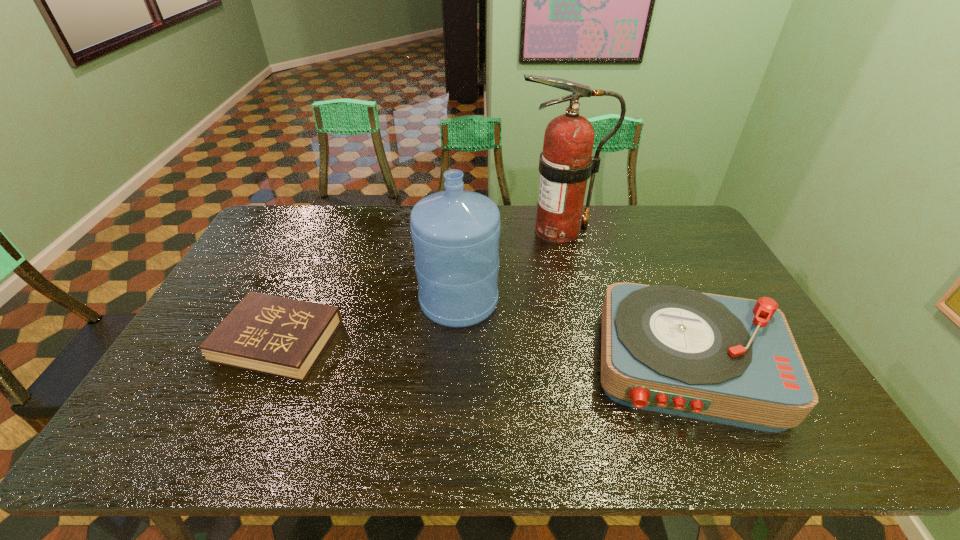
In the image, there is a desktop. Identify the location of vacant region at the far edge. This screenshot has height=540, width=960. (509, 213).

This screenshot has width=960, height=540. What are the coordinates of `vacant space at the near edge of the desktop` in the screenshot? It's located at (293, 433).

The height and width of the screenshot is (540, 960). I want to click on blank space at the left edge of the desktop, so click(237, 271).

At what (x,y) coordinates should I click in order to perform the action: click on vacant space at the right edge. Please return your answer as a coordinate pair (x, y). This screenshot has height=540, width=960. Looking at the image, I should click on (689, 246).

In the image, there is a desktop. What are the coordinates of `vacant space at the far right corner` in the screenshot? It's located at (671, 208).

Locate an element on the screen. Image resolution: width=960 pixels, height=540 pixels. vacant area that lies between the third shortest object and the leftmost object is located at coordinates (369, 321).

I want to click on vacant space that is in between the second tallest object and the tallest object, so click(x=508, y=266).

Image resolution: width=960 pixels, height=540 pixels. What are the coordinates of `free space between the hardback book and the tallest object` in the screenshot? It's located at (418, 286).

Where is `free area in between the second tallest object and the shortest object`? free area in between the second tallest object and the shortest object is located at coordinates (369, 321).

You are a GUI agent. You are given a task and a screenshot of the screen. Output one action in this format:
    pyautogui.click(x=<x>, y=<y>)
    Task: Click on the vacant space that is in between the fire extinguisher and the third shortest object
    
    Given the screenshot: What is the action you would take?
    pyautogui.click(x=508, y=266)